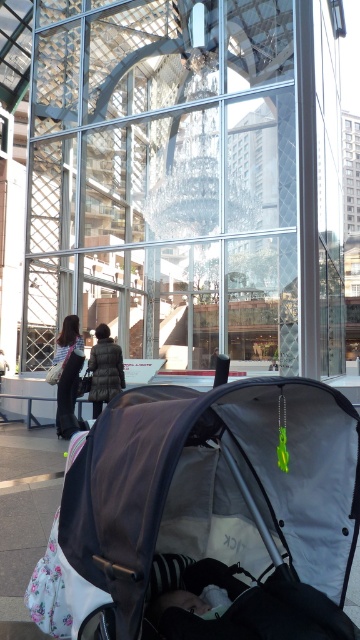
You are standing in the shopping mall and want to take a photo of the transparent glass mall at center through the dark gray down jacket at center. Will the jacket block your view of the glass mall?

The transparent glass mall at center is in front of the dark gray down jacket at center, so the jacket will not block your view of the glass mall because it is behind the glass.

You are a parent holding a dark gray down jacket at center and want to place it into the dark gray fabric baby carriage at lower left. Can you reach the carriage from your current position?

The dark gray fabric baby carriage at lower left is located above the dark gray down jacket at center, so yes, you can reach the carriage from your current position as it is positioned above you.

You are a photographer trying to capture the baby in the striped fabric dress at center while ensuring the background of the transparent glass mall at center doesn not reflect too much light. Which object should you focus on to avoid overexposure?

The striped fabric dress at center is much shorter than the transparent glass mall at center, so focusing on the dress will help avoid overexposure caused by the taller mall background.